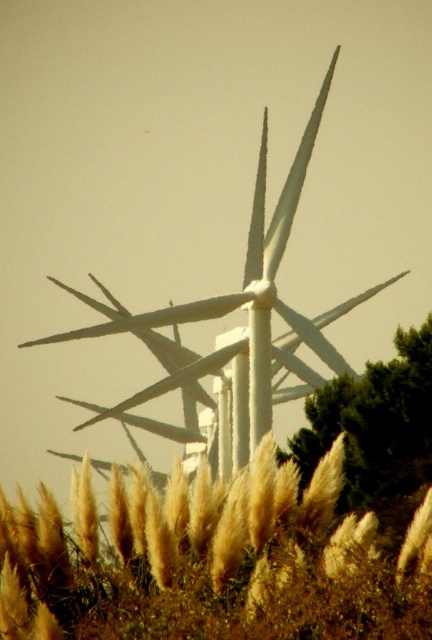
You are standing at the point marked as point (x=210, y=561) in the image. What is the immediate surface you are standing on?

The immediate surface you are standing on is the golden textured grass at lower center.

You are a drone operator planning to fly a drone from the golden textured grass at lower center to the white matte windmill at center. The drone has a maximum flight range of 200 feet. Can the drone reach the windmill without needing to recharge?

The distance between the golden textured grass at lower center and the white matte windmill at center is 186.50 feet, which is within the drone operator drone has a maximum flight range of 200 feet. The drone can reach the white matte windmill at center without needing to recharge.